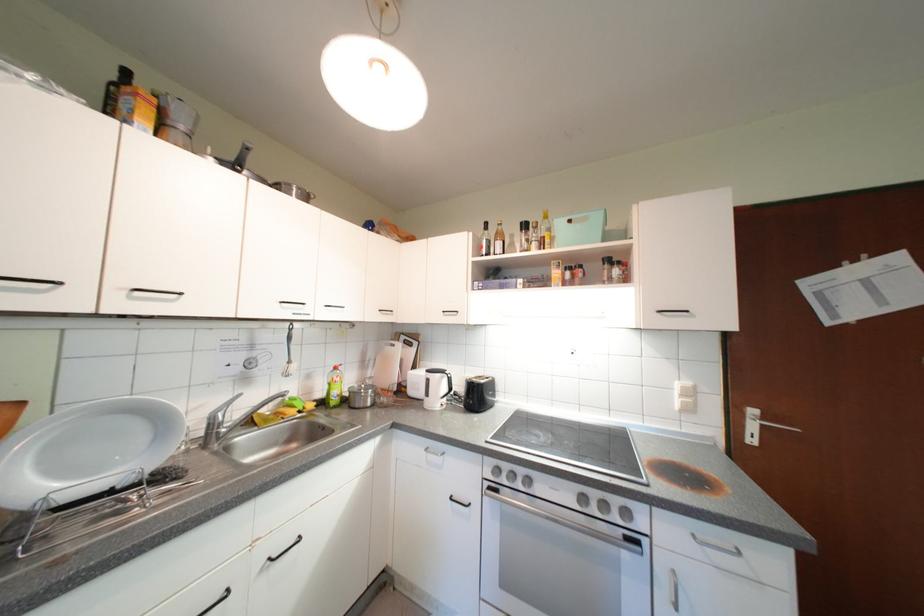
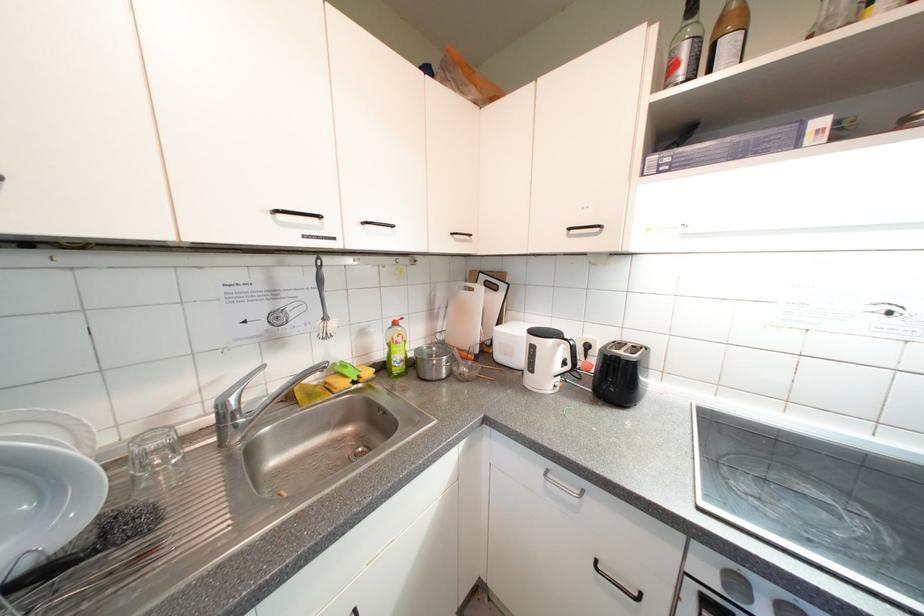
Where in the second image is the point corresponding to [222,428] from the first image?

(233, 419)